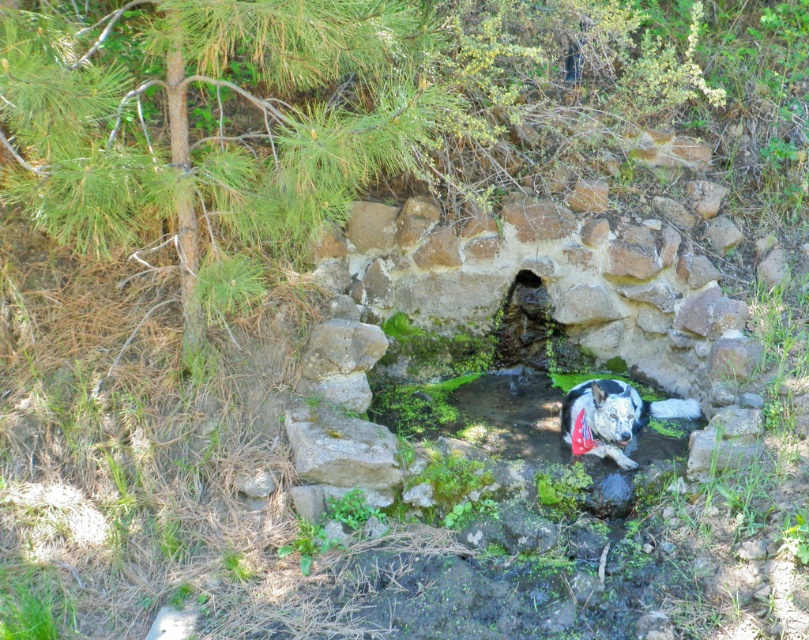
Who is lower down, green leafy tree at upper left or green mossy stone at center?

Positioned lower is green mossy stone at center.

Does green leafy tree at upper left have a lesser height compared to green mossy stone at center?

In fact, green leafy tree at upper left may be taller than green mossy stone at center.

Which is in front, point (333, 147) or point (521, 288)?

Point (333, 147) is in front.

The height and width of the screenshot is (640, 809). I want to click on green leafy tree at upper left, so click(215, 124).